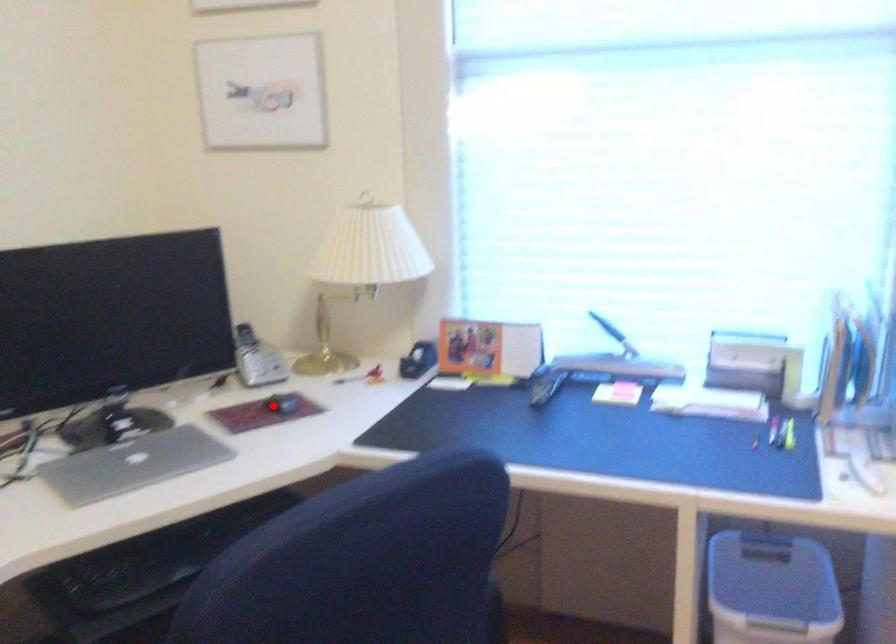
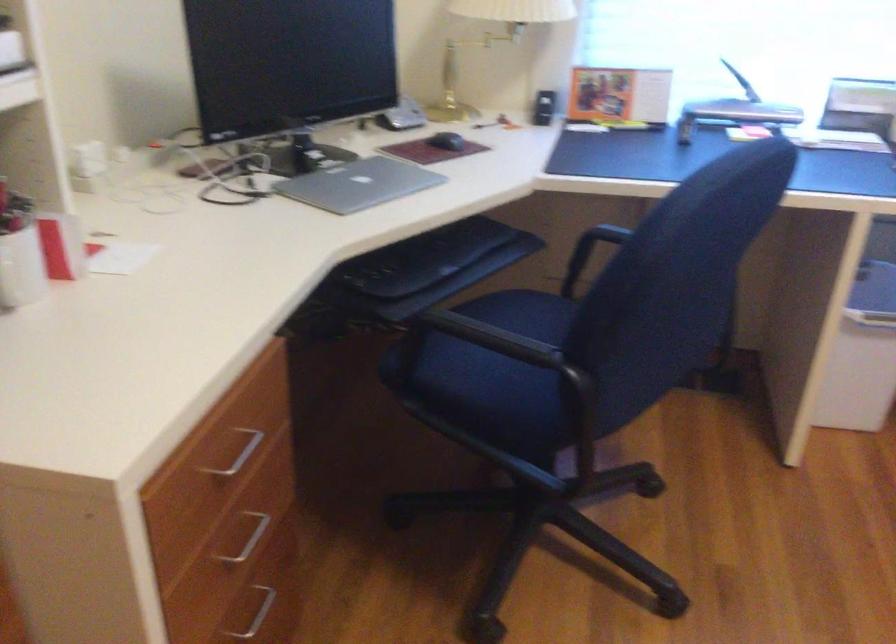
In the second image, find the point that corresponds to the highlighted location in the first image.

(446, 140)